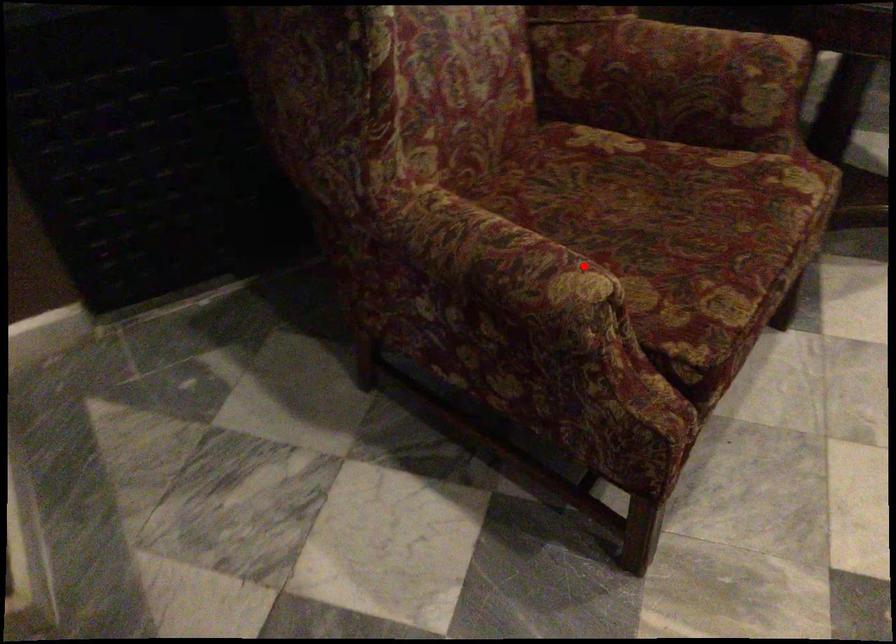
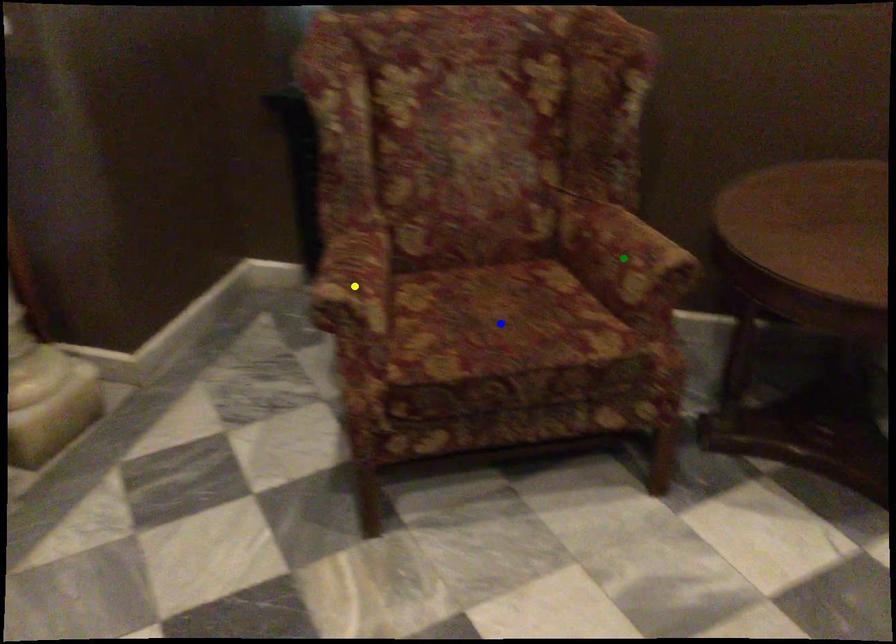
Question: I am providing you with two images of the same scene from different viewpoints. A red point is marked on the first image. You are given multiple points on the second image. Which spot in image 2 lines up with the point in image 1?

Choices:
 (A) green point
 (B) yellow point
 (C) blue point

Answer: (B)